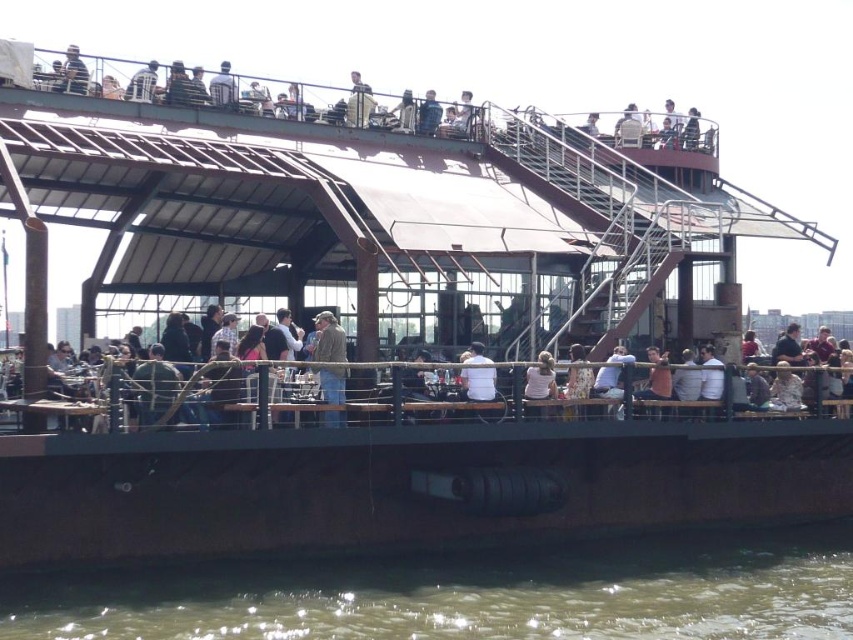
From the picture: Who is lower down, metallic silver jacket at upper center or blue denim jacket at upper center?

blue denim jacket at upper center is lower down.

Is metallic silver jacket at upper center taller than blue denim jacket at upper center?

Correct, metallic silver jacket at upper center is much taller as blue denim jacket at upper center.

The height and width of the screenshot is (640, 853). Find the location of `metallic silver jacket at upper center`. metallic silver jacket at upper center is located at coordinates (358, 102).

Can you confirm if khaki fabric jacket at center is wider than metallic silver jacket at upper center?

Incorrect, khaki fabric jacket at center's width does not surpass metallic silver jacket at upper center's.

Is point (335, 344) positioned behind point (364, 122)?

No, it is in front of (364, 122).

Locate an element on the screen. khaki fabric jacket at center is located at coordinates coord(329,339).

Does light brown wooden chair at lower center appear under white fabric shirt at upper center?

Yes.

Is light brown wooden chair at lower center shorter than white fabric shirt at upper center?

Correct, light brown wooden chair at lower center is not as tall as white fabric shirt at upper center.

The height and width of the screenshot is (640, 853). What are the coordinates of `light brown wooden chair at lower center` in the screenshot? It's located at (412, 392).